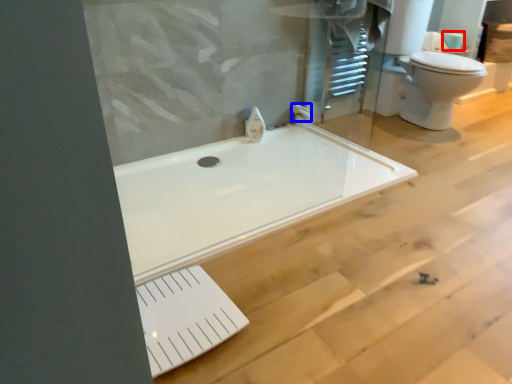
Question: Which object appears closest to the camera in this image, toilet paper (highlighted by a red box) or faucet (highlighted by a blue box)?

Choices:
 (A) toilet paper
 (B) faucet

Answer: (B)